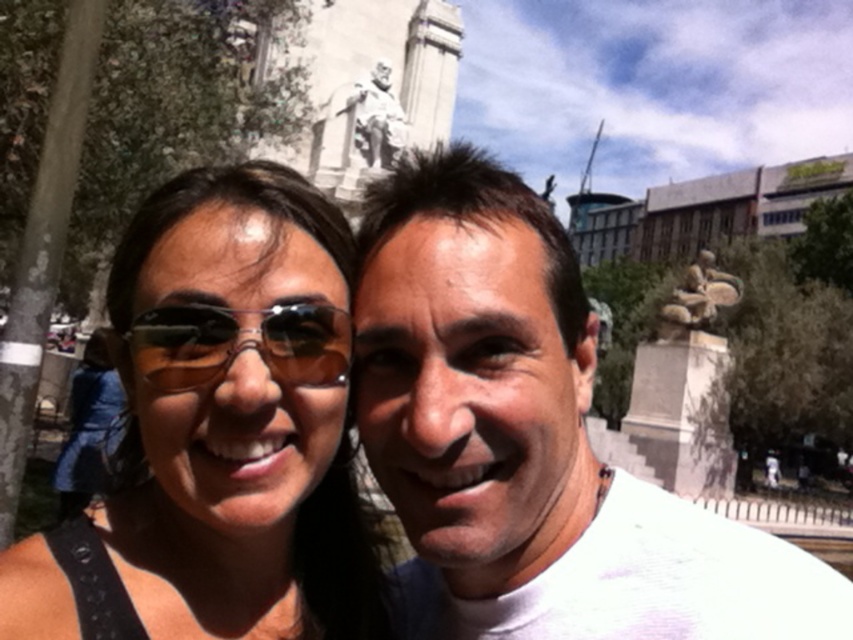
You are a photographer adjusting the focus on your camera. You need to ensure both the white matte shirt at center and the matte black sunglasses at center are in focus. Given their sizes, which object should you prioritize focusing on first to ensure clarity?

The white matte shirt at center has a larger size compared to the matte black sunglasses at center, so you should prioritize focusing on the white matte shirt at center first to ensure clarity.

You are standing at the point marked as point [496,502] in the image. The monument behind the two people is 20 meters tall. If you want to take a photo of the monument from your current position, will the monument fit entirely within the camera frame? Assume the camera has a standard field of view of 60 degrees.

The distance between you and the monument is 33.43 meters. The monument is 20 meters tall. Using trigonometry, the angle required to capture the entire monument would be 2 times arctangent of half the height divided by distance. Calculating 2 arctan 10m divided by 33.43m gives approximately 2 arctan 0.299, which is roughly 34 degrees. Since the camera has a 60 degree field of view, which is wider than 34 degrees, the monument will fit entirely within the frame.

You are a photographer trying to capture a group photo of the two people in the scene. The camera you are using has a maximum focus range of 8 meters. Can you focus on both the white matte shirt at center and the shiny black sunglasses at center simultaneously?

The distance between the white matte shirt at center and the shiny black sunglasses at center is 8.68 meters. Since the camera can only focus up to 8 meters, it cannot focus on both objects simultaneously because the distance exceeds the maximum focus range.